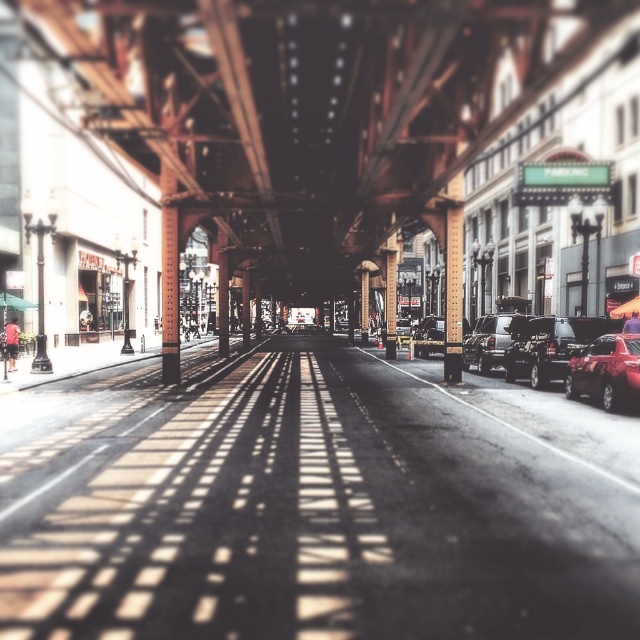
Based on the photo, who is taller, rusty metal overpass at center or metallic silver decker bus at center?

metallic silver decker bus at center

Is point (262, 106) less distant than point (298, 308)?

Yes.

Who is more distant from viewer, (x=189, y=225) or (x=310, y=321)?

The point (x=310, y=321) is behind.

The width and height of the screenshot is (640, 640). In order to click on rusty metal overpass at center in this screenshot , I will do `click(310, 106)`.

Who is more distant from viewer, (545, 365) or (502, 344)?

The point (502, 344) is more distant.

Does shiny black sedan at right have a smaller size compared to shiny black sedan at center-right?

No, shiny black sedan at right is not smaller than shiny black sedan at center-right.

Which is in front, point (552, 372) or point (500, 332)?

Point (552, 372)

The image size is (640, 640). Find the location of `shiny black sedan at right`. shiny black sedan at right is located at coordinates (548, 346).

Is shiny black sedan at right above smooth metal pole at center?

No.

The height and width of the screenshot is (640, 640). What do you see at coordinates (548, 346) in the screenshot?
I see `shiny black sedan at right` at bounding box center [548, 346].

Is point (516, 340) farther from viewer compared to point (454, 380)?

That is True.

The image size is (640, 640). I want to click on shiny black sedan at right, so click(x=548, y=346).